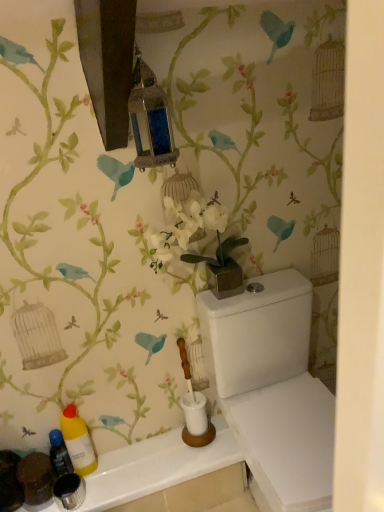
Question: From the image's perspective, is translucent plastic bottle at lower left, the first bottle viewed from the left, located above white glossy porcelain at lower right?

Choices:
 (A) yes
 (B) no

Answer: (B)

Question: Considering the relative positions of translucent plastic bottle at lower left, the 2th bottle when ordered from right to left, and white glossy porcelain at lower right in the image provided, is translucent plastic bottle at lower left, the 2th bottle when ordered from right to left, to the right of white glossy porcelain at lower right from the viewer's perspective?

Choices:
 (A) yes
 (B) no

Answer: (B)

Question: From the image's perspective, is translucent plastic bottle at lower left, the first bottle viewed from the left, under white glossy porcelain at lower right?

Choices:
 (A) yes
 (B) no

Answer: (A)

Question: Is translucent plastic bottle at lower left, the first bottle viewed from the left, to the left of white glossy porcelain at lower right from the viewer's perspective?

Choices:
 (A) no
 (B) yes

Answer: (B)

Question: Does translucent plastic bottle at lower left, the 2th bottle when ordered from right to left, have a greater height compared to white glossy porcelain at lower right?

Choices:
 (A) yes
 (B) no

Answer: (B)

Question: Relative to yellow matte bottle at lower left, which is counted as the second bottle, starting from the left, is translucent plastic bottle at lower left, the 2th bottle when ordered from right to left, in front or behind?

Choices:
 (A) behind
 (B) front

Answer: (A)

Question: From their relative heights in the image, would you say translucent plastic bottle at lower left, the 2th bottle when ordered from right to left, is taller or shorter than yellow matte bottle at lower left, which is counted as the second bottle, starting from the left?

Choices:
 (A) tall
 (B) short

Answer: (B)

Question: Is point (57, 433) positioned closer to the camera than point (74, 470)?

Choices:
 (A) closer
 (B) farther

Answer: (A)

Question: In terms of width, does translucent plastic bottle at lower left, the first bottle viewed from the left, look wider or thinner when compared to yellow matte bottle at lower left, which is counted as the second bottle, starting from the left?

Choices:
 (A) thin
 (B) wide

Answer: (A)

Question: In terms of width, does translucent plastic bottle at lower left, the 2th bottle when ordered from right to left, look wider or thinner when compared to white glossy counter top at lower left?

Choices:
 (A) wide
 (B) thin

Answer: (B)

Question: Is translucent plastic bottle at lower left, the 2th bottle when ordered from right to left, inside or outside of white glossy counter top at lower left?

Choices:
 (A) inside
 (B) outside

Answer: (B)

Question: Is translucent plastic bottle at lower left, the first bottle viewed from the left, in front of or behind white glossy counter top at lower left in the image?

Choices:
 (A) behind
 (B) front

Answer: (A)

Question: In terms of size, does translucent plastic bottle at lower left, the 2th bottle when ordered from right to left, appear bigger or smaller than white glossy counter top at lower left?

Choices:
 (A) big
 (B) small

Answer: (B)

Question: Does point (94, 478) appear closer or farther from the camera than point (61, 439)?

Choices:
 (A) farther
 (B) closer

Answer: (A)

Question: Do you think white glossy counter top at lower left is within translucent plastic bottle at lower left, the 2th bottle when ordered from right to left, or outside of it?

Choices:
 (A) inside
 (B) outside

Answer: (B)